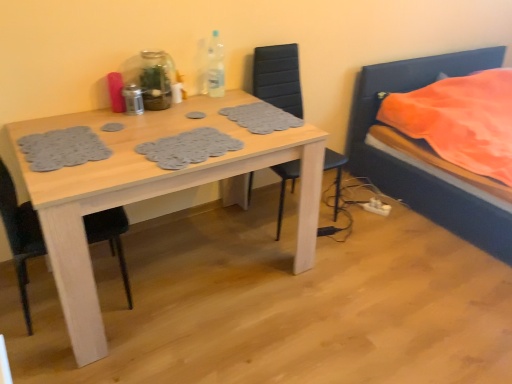
What are the coordinates of `vacant space that is in between light wood table at center and black matte chair at left, which ranks as the 1th chair in left-to-right order` in the screenshot? It's located at (52, 337).